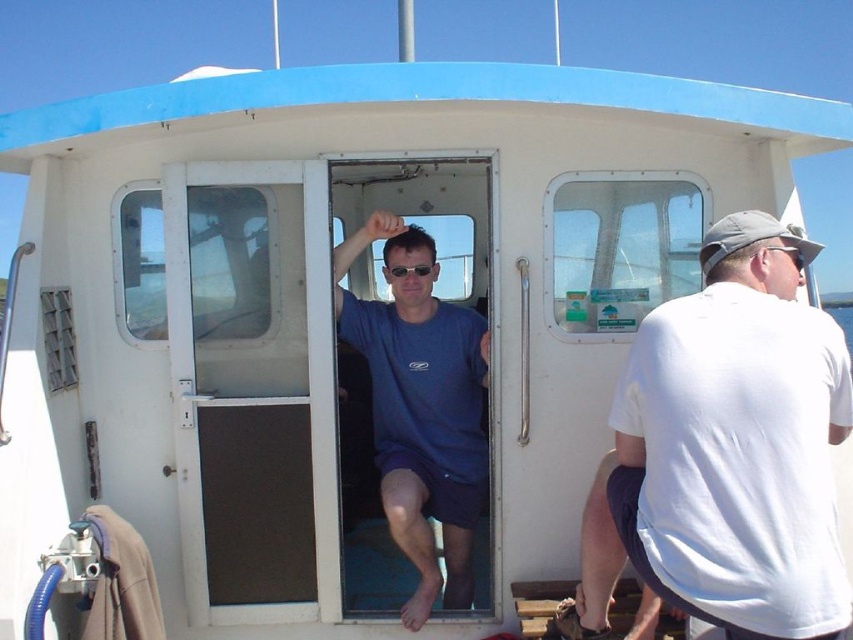
You are standing on the boat and want to move from the point at coordinate point [810,310] to the point at coordinate point [421,275]. Which direction should you move to reach the second point?

To move from point [810,310] to point [421,275], you should move backward since point [810,310] is in front of point [421,275].

You are a passenger on the boat and want to put on your clear plastic goggles at upper right. Which direction should you look to find them relative to your blue matte shirt at center?

The clear plastic goggles at upper right are above the blue matte shirt at center, so you should look upward to find them.